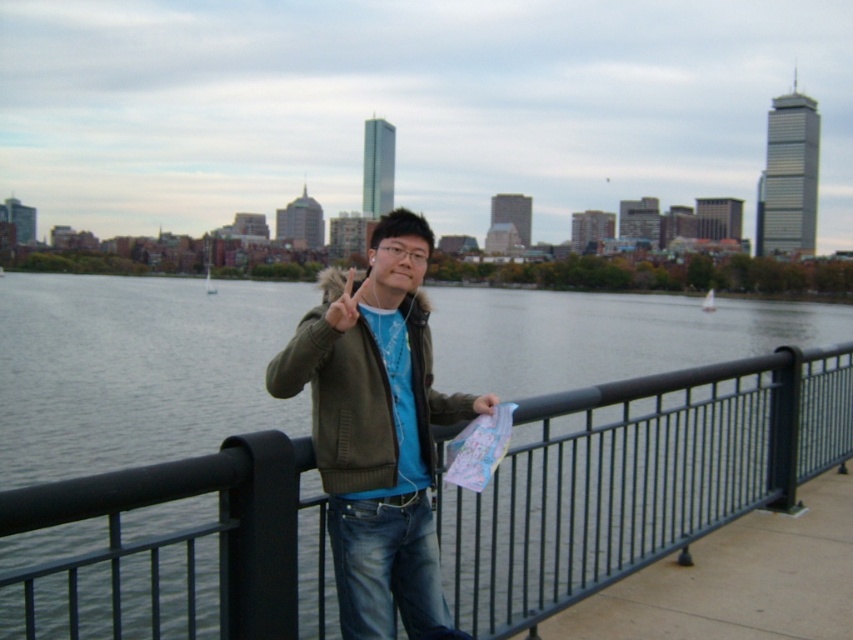
You are a photographer trying to capture the city skyline in the background. To ensure the black metal fence at center is not blocking the view, where should you position yourself relative to the point marked by the coordinates point (637, 477)?

The point marked by the coordinates point (637, 477) marks the location of the black metal fence at center. To avoid blocking the city skyline, you should position yourself to the side or behind this point so the fence does not obstruct the view.

You are a photographer trying to capture a clear shot of the city skyline through the black metal fence at center. The matte green jacket at center is blocking your view. Can you adjust your position so that the fence is visible without the jacket obstructing it?

The black metal fence at center is positioned under the matte green jacket at center, so moving your camera or position downward would allow you to see the fence without the jacket blocking it.